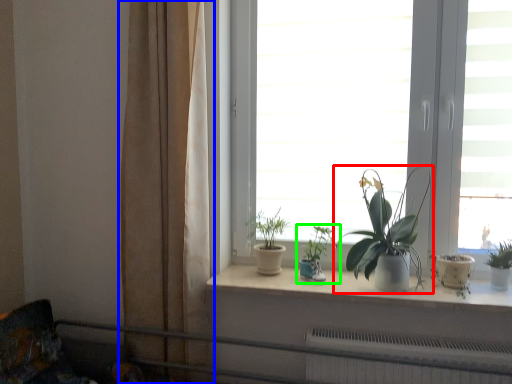
Question: Estimate the real-world distances between objects in this image. Which object is closer to houseplant (highlighted by a red box), curtain (highlighted by a blue box) or houseplant (highlighted by a green box)?

Choices:
 (A) curtain
 (B) houseplant

Answer: (B)